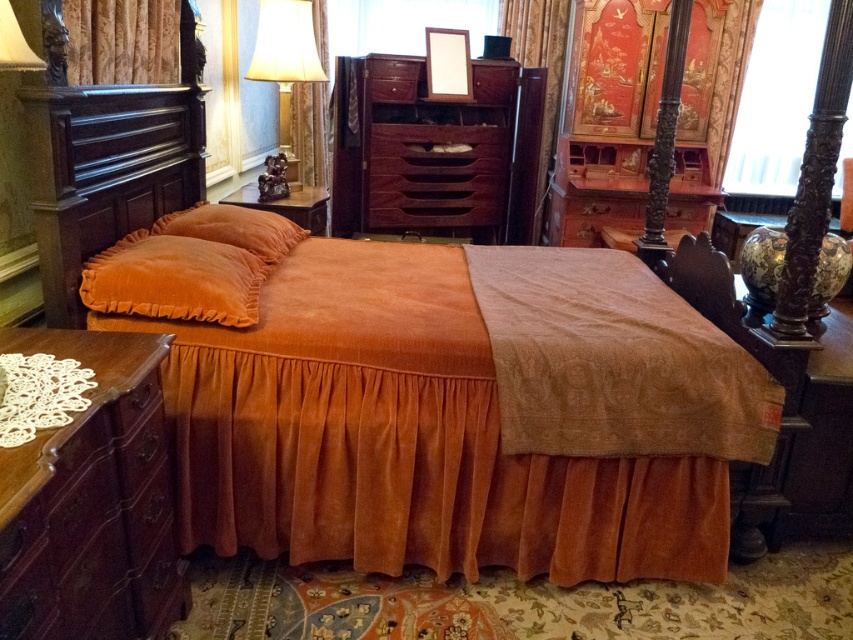
Can you confirm if velvet orange bed at center is positioned to the left of mahogany wood dresser at lower left?

In fact, velvet orange bed at center is to the right of mahogany wood dresser at lower left.

Which is more to the left, velvet orange bed at center or mahogany wood dresser at lower left?

From the viewer's perspective, mahogany wood dresser at lower left appears more on the left side.

The height and width of the screenshot is (640, 853). Find the location of `velvet orange bed at center`. velvet orange bed at center is located at coordinates point(403,436).

Which of these two, velvet orange bed at center or velvet orange blanket at center, stands taller?

velvet orange bed at center

Where is `velvet orange bed at center`? velvet orange bed at center is located at coordinates (403, 436).

Is velvet orange pillow at upper left below velvet curtain at upper left?

Correct, velvet orange pillow at upper left is located below velvet curtain at upper left.

Between velvet orange pillow at upper left and velvet curtain at upper left, which one appears on the left side from the viewer's perspective?

velvet curtain at upper left is more to the left.

What do you see at coordinates (173, 280) in the screenshot? This screenshot has height=640, width=853. I see `velvet orange pillow at upper left` at bounding box center [173, 280].

Find the location of a particular element. Image resolution: width=853 pixels, height=640 pixels. velvet orange pillow at upper left is located at coordinates (173, 280).